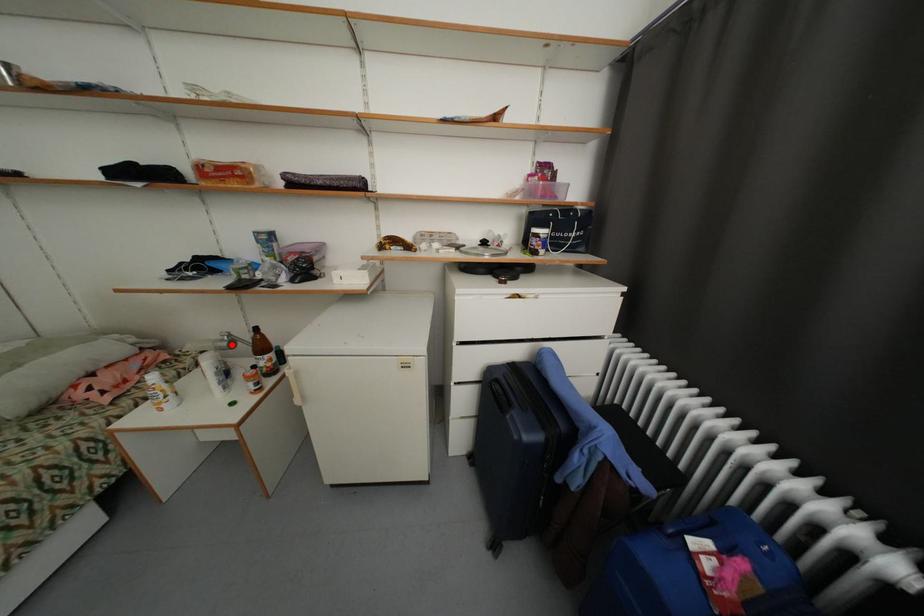
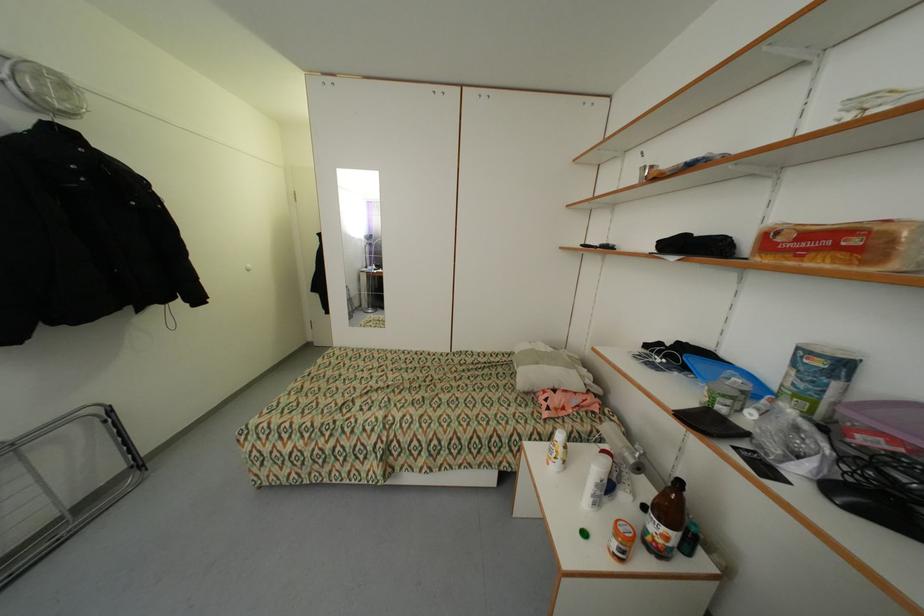
Question: A red point is marked in image1. In image2, is the corresponding 3D point closer to the camera or farther? Reply with the corresponding letter.

Choices:
 (A) The corresponding 3D point is closer.
 (B) The corresponding 3D point is farther.

Answer: (A)